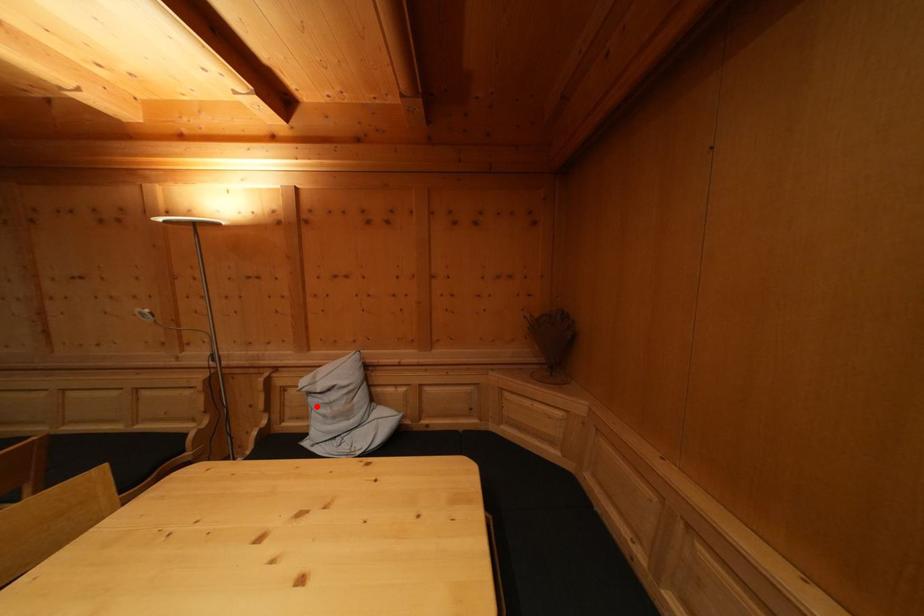
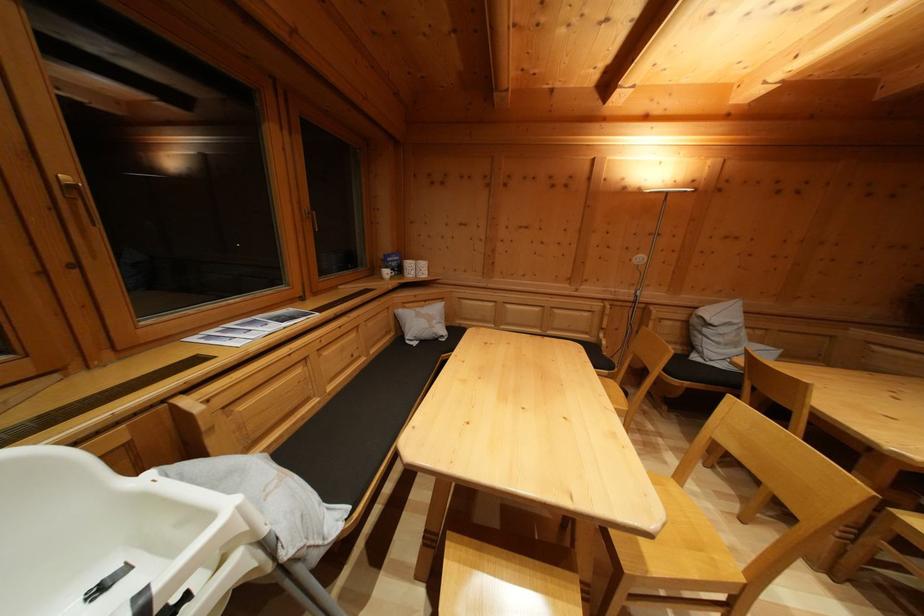
Locate, in the second image, the point that corresponds to the highlighted location in the first image.

(711, 337)